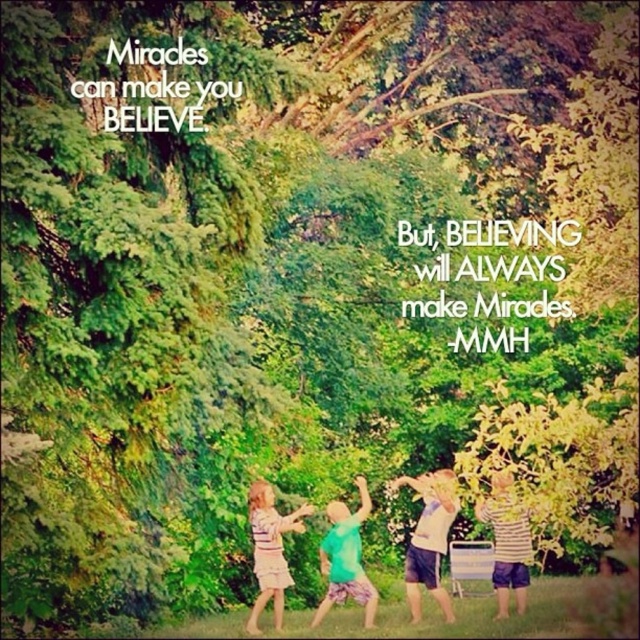
You are a photographer trying to capture a group photo of the children in the park. The two children wearing the white cotton shirt at center and the green matte shirt at center are standing 5.26 feet apart. If your camera has a focal length of 50mm and you want to ensure both are in frame without cropping, what is the minimum distance you should stand from them?

The minimum distance should be calculated using the formula distance > object size in feet multiplied by focal length divided by sensor size. Assuming a full frame sensor with 36mm width, the required distance would be greater than 5.26 feet multiplied by 50mm divided by 36mm, resulting in approximately 7.3 feet. Therefore, standing at least 7.3 feet away ensures both the white cotton shirt at center and green matte shirt at center are in frame.

What is the color of the clothing worn by the child located at the coordinates point (429, 538)?

The child at point (429, 538) is wearing a white cotton shirt.

You are a photographer trying to capture a photo of the two children in the scene. The children are wearing the green matte shirt at center and the striped fabric dress at lower left. Based on their positions, which child should you focus on first if you want to ensure both are in the frame without moving the camera?

The green matte shirt at center is located below the striped fabric dress at lower left. Since the striped fabric dress at lower left is higher up, you should focus on the striped fabric dress at lower left first to ensure both are in the frame without moving the camera.